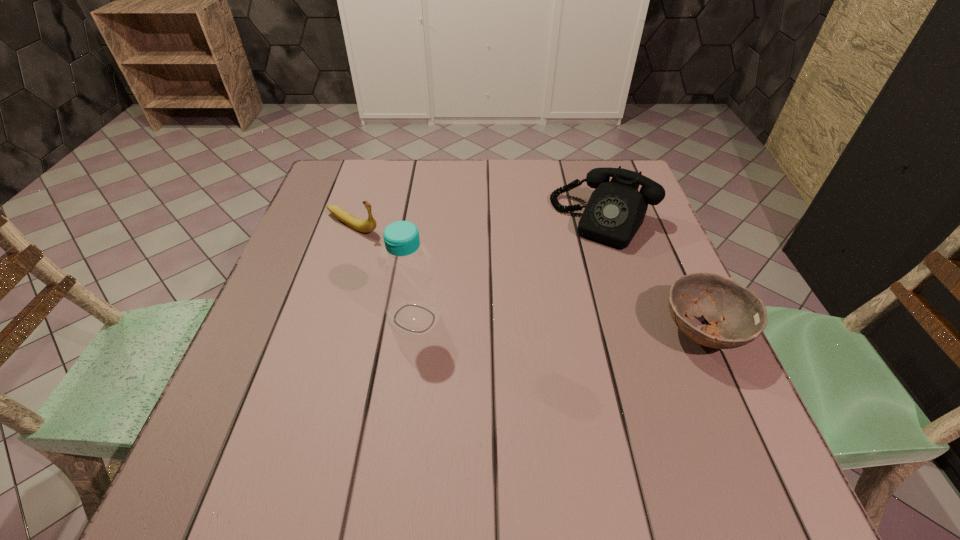
Where is `vacant area at the near edge`? vacant area at the near edge is located at coordinates (575, 416).

Locate an element on the screen. vacant space at the right edge is located at coordinates (663, 269).

In the image, there is a desktop. What are the coordinates of `vacant space at the far left corner` in the screenshot? It's located at (342, 193).

Image resolution: width=960 pixels, height=540 pixels. What are the coordinates of `blank space at the far right corner of the desktop` in the screenshot? It's located at (579, 168).

Image resolution: width=960 pixels, height=540 pixels. In the image, there is a desktop. Identify the location of free region at the near right corner. (717, 405).

Locate an element on the screen. The width and height of the screenshot is (960, 540). free space between the telephone and the shortest object is located at coordinates (654, 276).

Locate an element on the screen. This screenshot has height=540, width=960. free spot between the tallest object and the telephone is located at coordinates (510, 269).

Locate an element on the screen. The height and width of the screenshot is (540, 960). empty space that is in between the telephone and the bowl is located at coordinates (654, 276).

You are a GUI agent. You are given a task and a screenshot of the screen. Output one action in this format:
    pyautogui.click(x=<x>, y=<y>)
    Task: Click on the free space between the shortest object and the telephone
    This screenshot has height=540, width=960.
    Given the screenshot: What is the action you would take?
    pyautogui.click(x=654, y=276)

Locate an element on the screen. The width and height of the screenshot is (960, 540). vacant area that lies between the tallest object and the telephone is located at coordinates (510, 269).